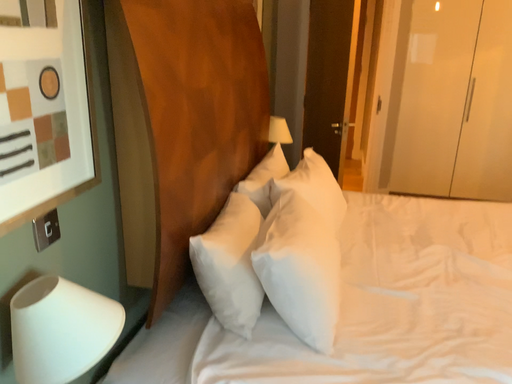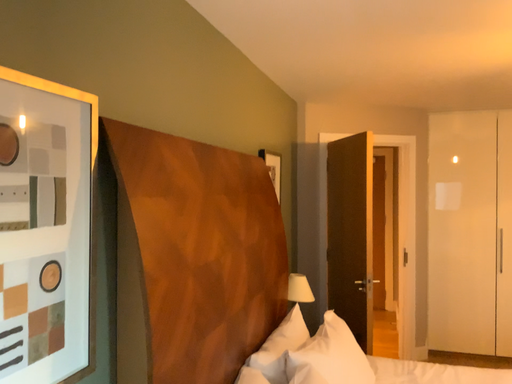
Question: Which way did the camera rotate in the video?

Choices:
 (A) rotated upward
 (B) rotated downward

Answer: (A)